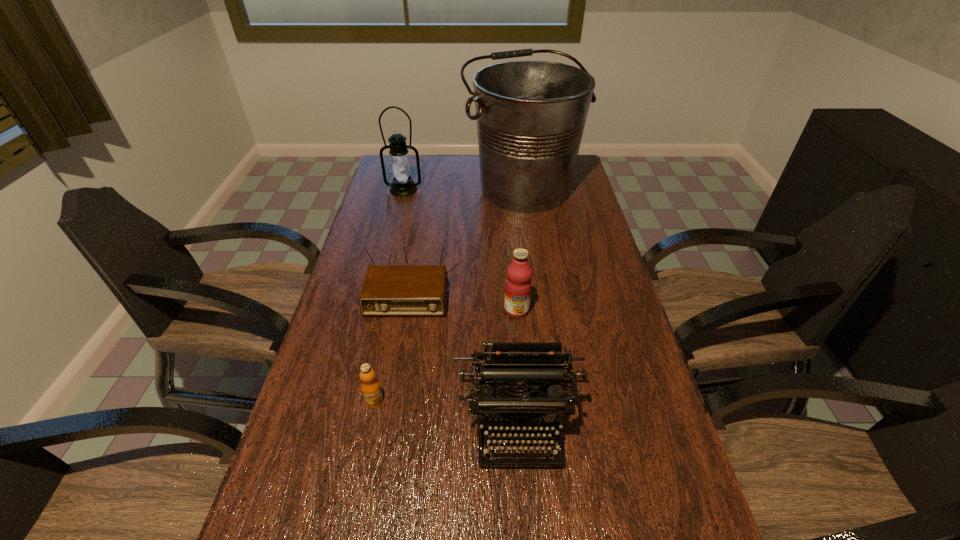
In order to click on free spot located 0.050m on the keyboard of the typewriter in this screenshot , I will do `click(522, 495)`.

Identify the location of free location located 0.180m on the front label of the orange juice. (357, 489).

Image resolution: width=960 pixels, height=540 pixels. What are the coordinates of `bucket present at the far edge` in the screenshot? It's located at (531, 114).

Where is `lantern located in the far edge section of the desktop`? lantern located in the far edge section of the desktop is located at coordinates (403, 185).

Where is `lantern located at the left edge`? lantern located at the left edge is located at coordinates (403, 185).

Locate an element on the screen. The height and width of the screenshot is (540, 960). radio_receiver that is at the left edge is located at coordinates (388, 290).

The width and height of the screenshot is (960, 540). In order to click on orange juice situated at the left edge in this screenshot , I will do `click(370, 386)`.

This screenshot has width=960, height=540. I want to click on object that is at the right edge, so point(531,114).

Identify the location of object that is at the far left corner. (403, 185).

I want to click on object that is at the far right corner, so click(x=531, y=114).